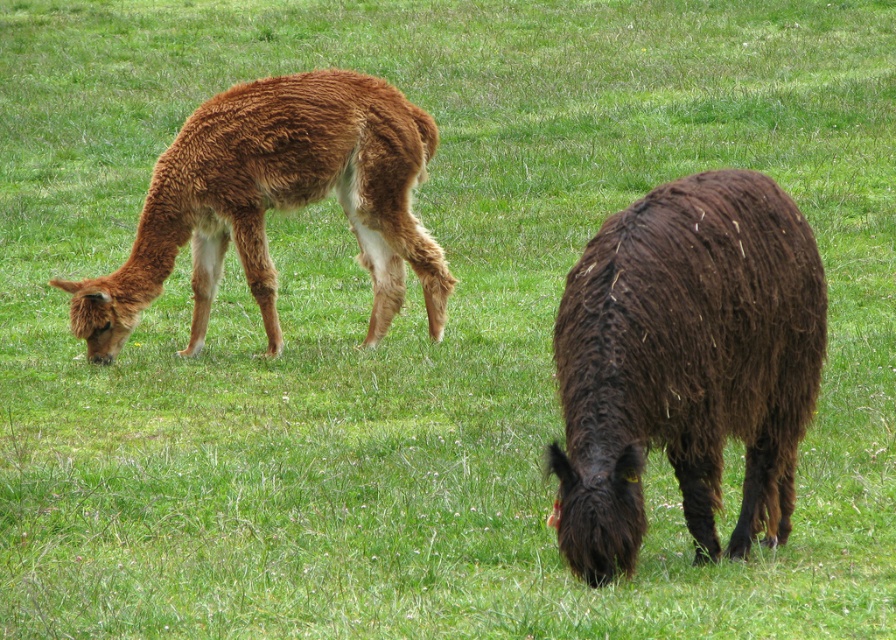
You are standing in the field and want to approach the dark brown woolly alpaca at right. Based on its position coordinates, can you determine if it is closer to the center of the field or the edge?

The dark brown woolly alpaca at right is located at point [686,364]. Since both coordinates are between 0 and 1, the center of the field would be at [448,320]. The alpaca is closer to the edge because its coordinates are further away from the center point.

You are a farmer checking on your alpacas in the field. You notice the dark brown woolly alpaca at right and the brown woolly alpaca at left. Which alpaca is closer to you?

The dark brown woolly alpaca at right is closer to you because it is in front of the brown woolly alpaca at left.